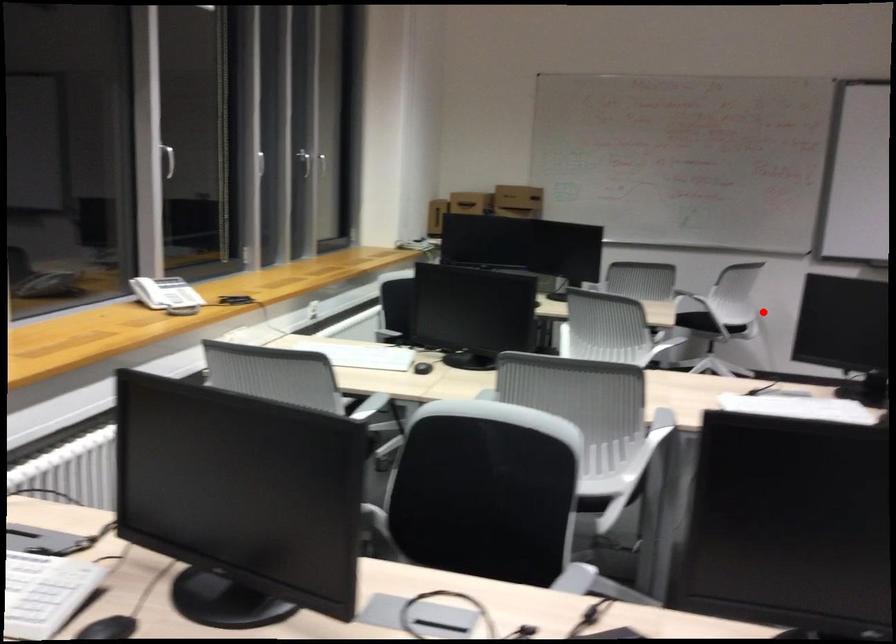
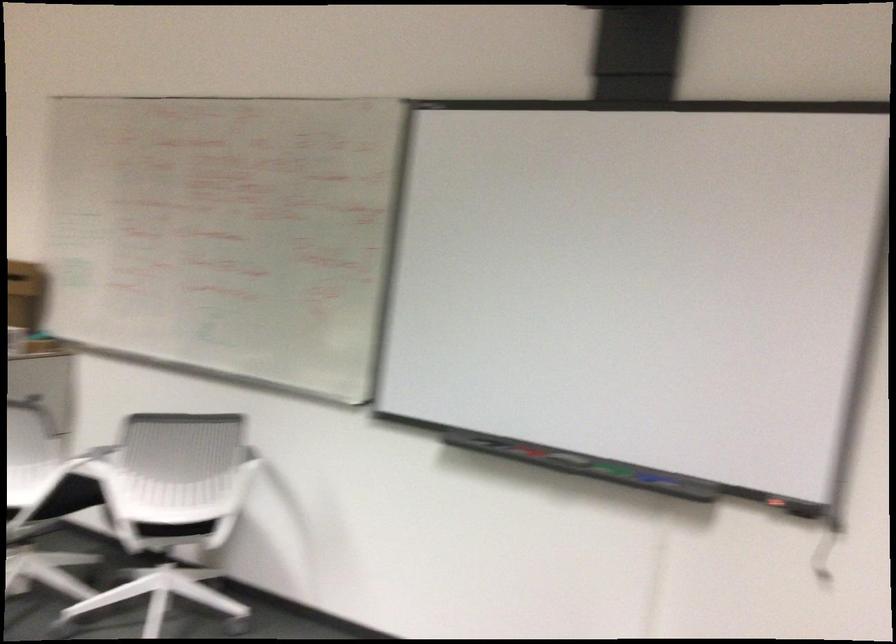
Question: I am providing you with two images of the same scene from different viewpoints. Image1 has a red point marked. In image2, the corresponding 3D location appears at what relative position? Reply with the corresponding letter.

Choices:
 (A) Closer
 (B) Farther

Answer: (A)